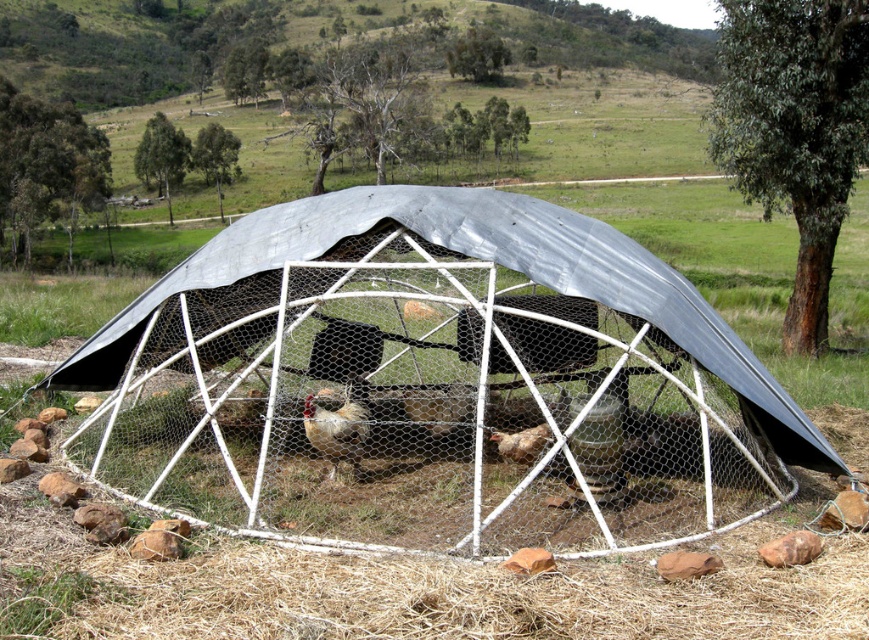
You are a farmer who needs to check the space between the metallic wire mesh cage at center and the golden brown feathers at center. Can you walk through it comfortably?

The metallic wire mesh cage at center is wider than the golden brown feathers at center. The space between them might be narrow, so it may be tight for you to walk through comfortably.

Consider the image. You are a farmer checking the health of your poultry. You notice two groups of feathers on the ground inside the geodesic dome. The first group is golden brown feathers at center and the second group is brown speckled feathers at center. Which group of feathers has a smaller width?

The golden brown feathers at center has a lesser width compared to brown speckled feathers at center.

You are a farmer checking on your animals in the geodesic dome. You notice the metallic wire mesh cage at center and the brown speckled feathers at center. Which object is closer to you from your current viewpoint?

The metallic wire mesh cage at center is closer to you than the brown speckled feathers at center.